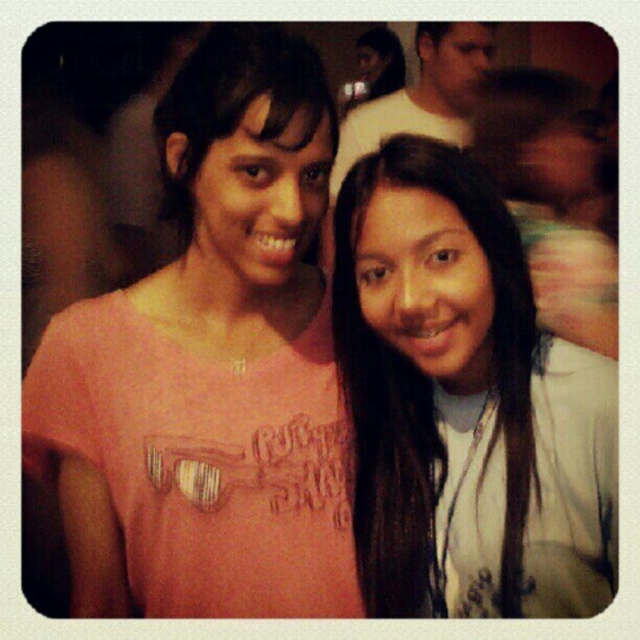
Does pink matte t-shirt at center appear on the right side of white matte hair at center?

Incorrect, pink matte t-shirt at center is not on the right side of white matte hair at center.

Locate an element on the screen. This screenshot has width=640, height=640. pink matte t-shirt at center is located at coordinates (211, 365).

In the scene shown: Measure the distance between point [509,268] and camera.

Point [509,268] is 36.40 inches away from camera.

Where is `white matte hair at center`? white matte hair at center is located at coordinates (465, 403).

Between pink matte t-shirt at center and matte white shirt at upper center, which one has more height?

With more height is pink matte t-shirt at center.

Can you confirm if pink matte t-shirt at center is positioned below matte white shirt at upper center?

Indeed, pink matte t-shirt at center is positioned under matte white shirt at upper center.

Does point (244, 349) come in front of point (474, 90)?

That is True.

The image size is (640, 640). What are the coordinates of `pink matte t-shirt at center` in the screenshot? It's located at (211, 365).